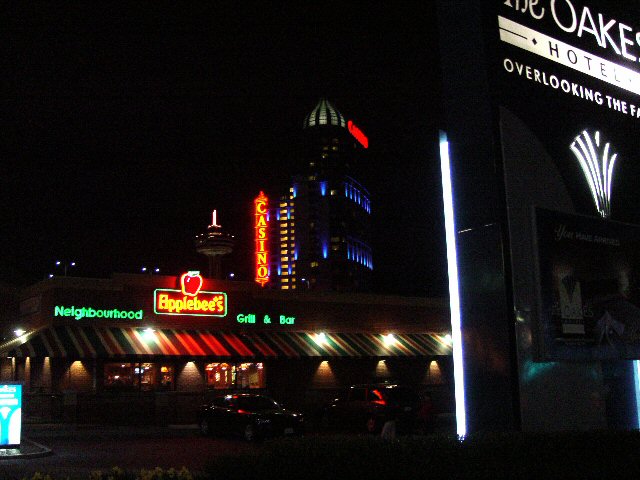
Where is `window`? This screenshot has width=640, height=480. window is located at coordinates (324, 191).